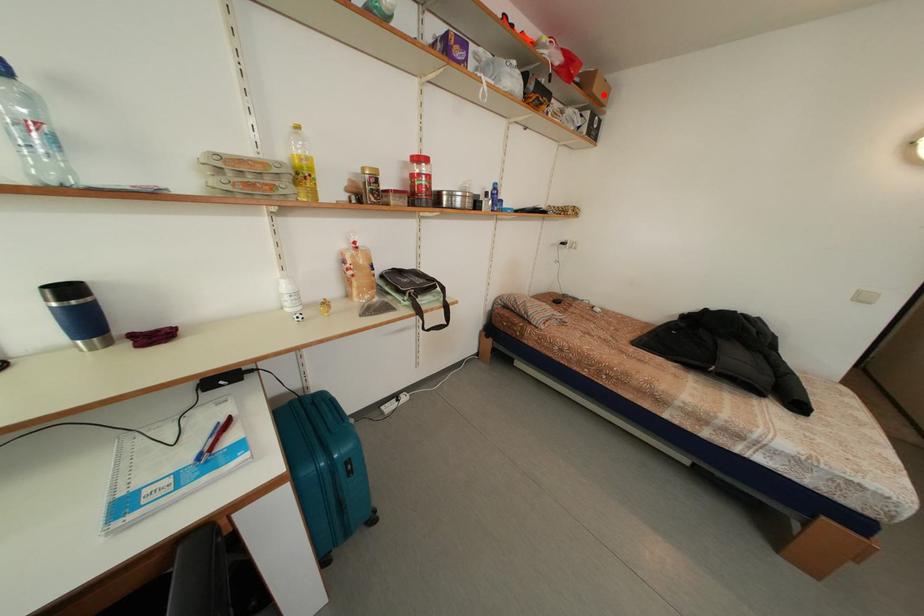
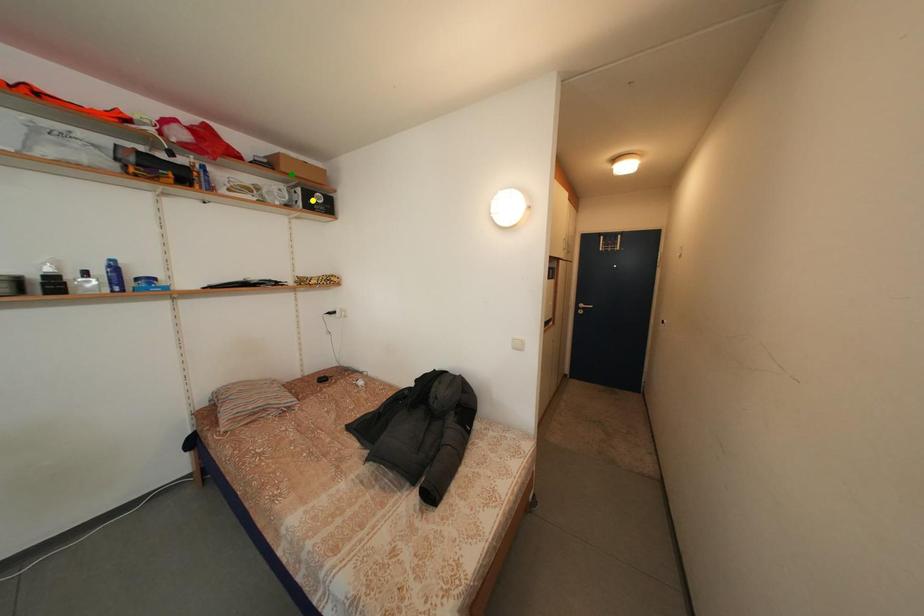
Question: I am providing you with two images of the same scene from different viewpoints. A red point is marked on the first image. You are given multiple points on the second image. In image 2, which mark is for the same physical point as the one in image 1?

Choices:
 (A) blue point
 (B) green point
 (C) yellow point

Answer: (B)